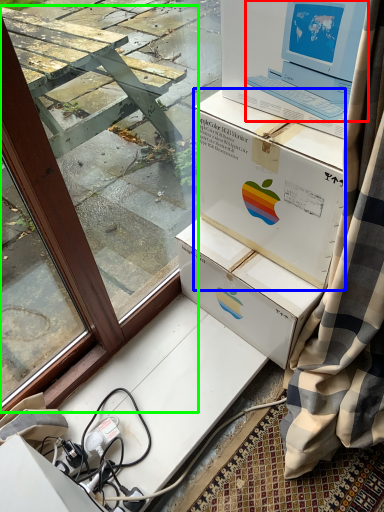
Question: Estimate the real-world distances between objects in this image. Which object is closer to laptop (highlighted by a red box), box (highlighted by a blue box) or window frame (highlighted by a green box)?

Choices:
 (A) box
 (B) window frame

Answer: (A)